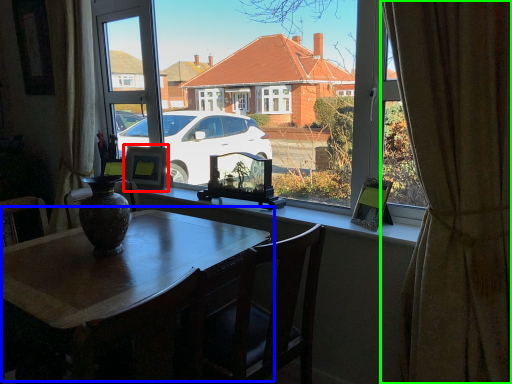
Question: Which is farther away from picture frame (highlighted by a red box)? table (highlighted by a blue box) or curtain (highlighted by a green box)?

Choices:
 (A) table
 (B) curtain

Answer: (B)